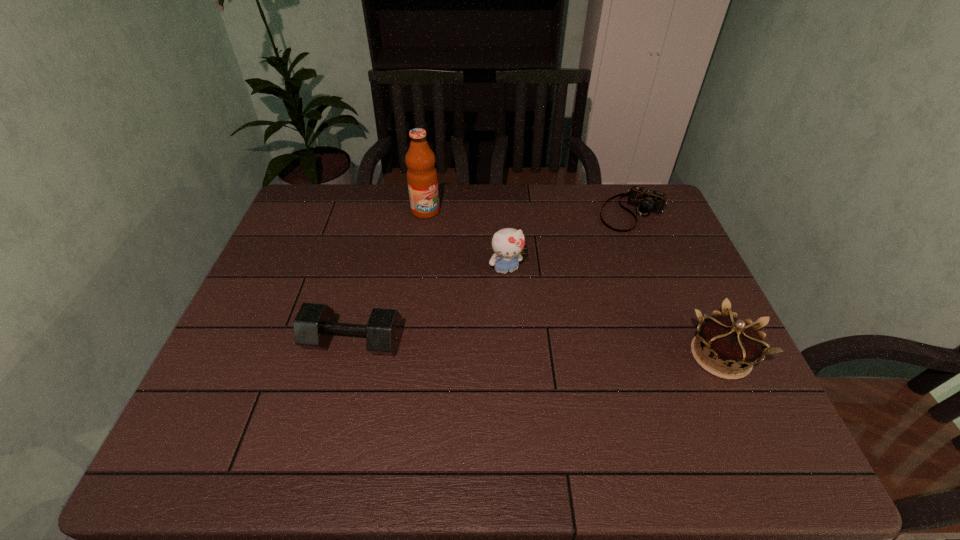
The height and width of the screenshot is (540, 960). Find the location of `free spot on the desktop that is between the dumbbell and the third tallest object and is positioned on the front-facing side of the shortest object`. free spot on the desktop that is between the dumbbell and the third tallest object and is positioned on the front-facing side of the shortest object is located at coordinates (536, 349).

Where is `vacant spot on the desktop that is between the fourth tallest object and the crown and is positioned on the front-facing side of the third object from right to left`? The height and width of the screenshot is (540, 960). vacant spot on the desktop that is between the fourth tallest object and the crown and is positioned on the front-facing side of the third object from right to left is located at coordinates (539, 349).

I want to click on vacant space on the desktop that is between the second shortest object and the third shortest object and is positioned on the front label of the fruit juice, so [588, 351].